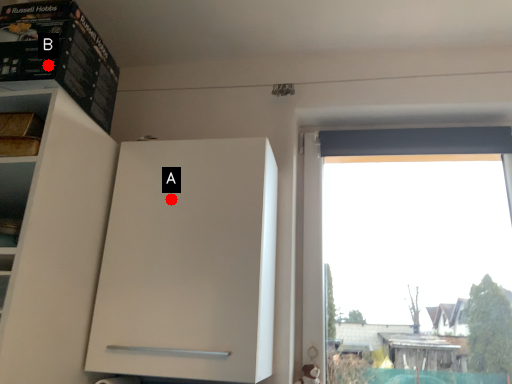
Question: Two points are circled on the image, labeled by A and B beside each circle. Which point is closer to the camera?

Choices:
 (A) A is closer
 (B) B is closer

Answer: (B)